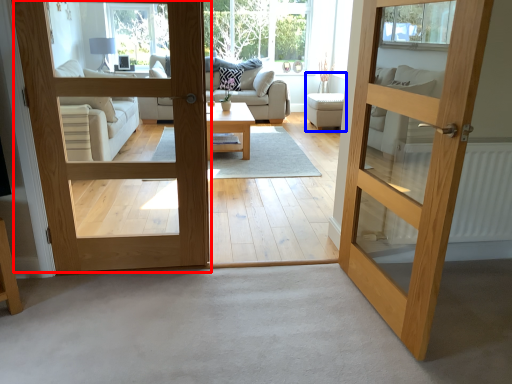
Question: Which point is further to the camera, door (highlighted by a red box) or armchair (highlighted by a blue box)?

Choices:
 (A) door
 (B) armchair

Answer: (B)